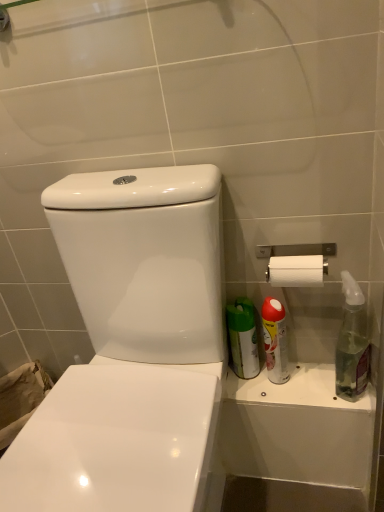
At what (x,y) coordinates should I click in order to perform the action: click on empty space that is in between red matte spray can at right, positioned as the first cleaning product in left-to-right order, and clear glass spray bottle at right, positioned as the 1th cleaning product in right-to-left order. Please return your answer as a coordinate pair (x, y). This screenshot has height=512, width=384. Looking at the image, I should click on (320, 383).